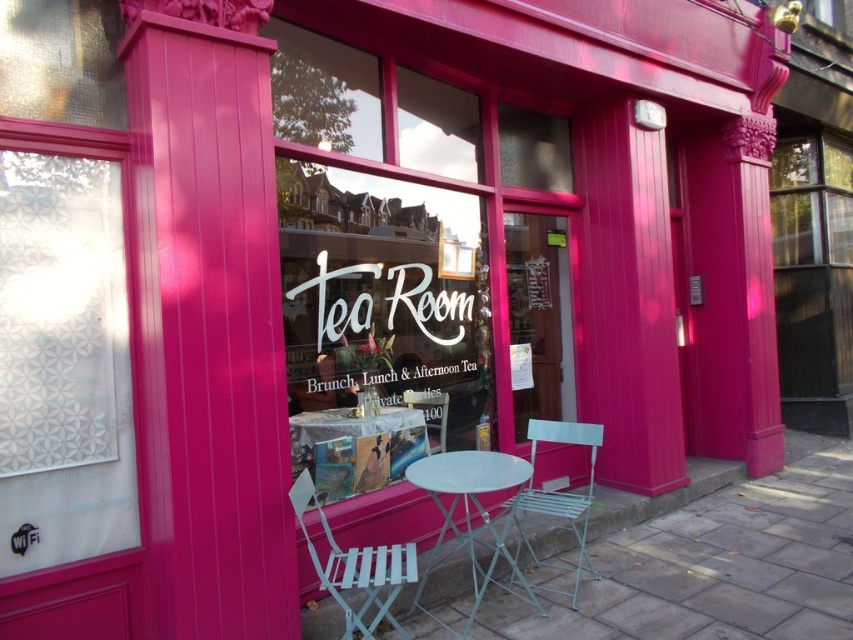
What do you see at coordinates (355, 449) in the screenshot?
I see `white plastic table at center` at bounding box center [355, 449].

Is white plastic table at center wider than white striped fabric chair at lower center?

Yes, white plastic table at center is wider than white striped fabric chair at lower center.

Who is more forward, (x=345, y=412) or (x=381, y=566)?

Point (x=381, y=566) is more forward.

Locate an element on the screen. white plastic table at center is located at coordinates coord(355,449).

Is point (45, 230) behind point (468, 513)?

No.

Does transparent paper at upper left have a lesser width compared to metallic silver table at center?

Yes, transparent paper at upper left is thinner than metallic silver table at center.

Based on the photo, who is more distant from viewer, (114, 134) or (469, 532)?

The point (469, 532) is behind.

Where is `transparent paper at upper left`? This screenshot has width=853, height=640. transparent paper at upper left is located at coordinates (62, 349).

Is transparent paper at upper left wider than white plastic table at center?

No, transparent paper at upper left is not wider than white plastic table at center.

Is transparent paper at upper left shorter than white plastic table at center?

In fact, transparent paper at upper left may be taller than white plastic table at center.

Is point (62, 163) farther from viewer compared to point (424, 451)?

No, it is in front of (424, 451).

What are the coordinates of `transparent paper at upper left` in the screenshot? It's located at (62, 349).